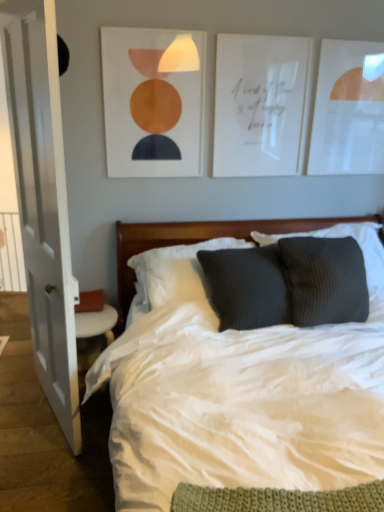
Question: Considering the positions of point [167, 74] and point [167, 393], is point [167, 74] closer or farther from the camera than point [167, 393]?

Choices:
 (A) farther
 (B) closer

Answer: (A)

Question: In the image, is matte orange circle at upper center, which is the third picture frame in right-to-left order, on the left side or the right side of white soft bed at center?

Choices:
 (A) right
 (B) left

Answer: (B)

Question: Which is farther from the white plastic radiator at left?

Choices:
 (A) white wood door at left
 (B) white paper picture frame at upper right, the first picture frame positioned from the right
 (C) white paper picture frame at upper center, the 2th picture frame positioned from the right
 (D) dark gray ribbed pillow at center, the first pillow when ordered from right to left
 (E) wooden headboard at center

Answer: (B)

Question: Based on their relative distances, which object is farther from the white paper picture frame at upper right, the first picture frame positioned from the right?

Choices:
 (A) ribbed dark gray pillow at center, which ranks as the first pillow in left-to-right order
 (B) white plastic radiator at left
 (C) wooden headboard at center
 (D) dark gray ribbed pillow at center, the first pillow when ordered from right to left
 (E) white soft bed at center

Answer: (B)